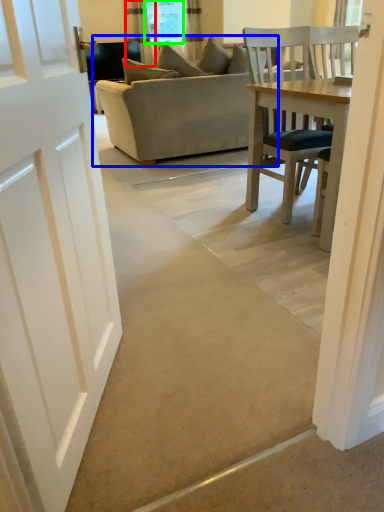
Question: Considering the real-world distances, which object is closest to curtain (highlighted by a red box)? studio couch (highlighted by a blue box) or window screen (highlighted by a green box).

Choices:
 (A) studio couch
 (B) window screen

Answer: (B)